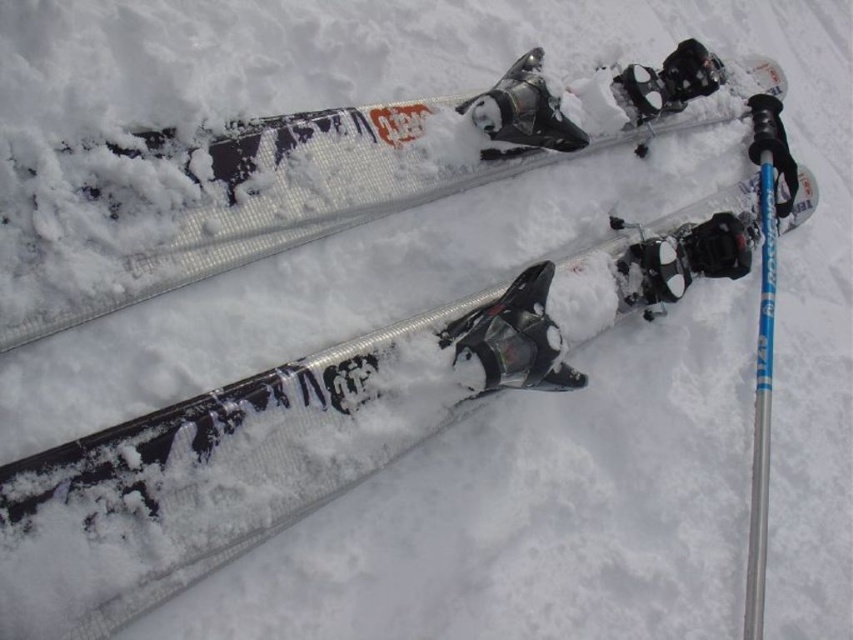
From the picture: You are a winter sports enthusiast who wants to organize your gear. You have a storage rack with two hooks. The left hook can hold up to 1.2 meters in length, and the right hook can hold up to 1 meter. You need to hang the silver metallic skis at center and the blue metallic pole at right. Based on their positions in the image, which object should go on which hook to ensure they fit properly?

The silver metallic skis at center should be placed on the left hook because they are longer than the blue metallic pole at right, and the left hook can hold up to 1.2 meters. The blue metallic pole at right should go on the right hook since it is shorter and fits within the 1 meter limit.

You are a photographer trying to capture the silver metallic skis at center in your shot. Based on their position coordinates, where should you aim your camera to ensure they are centered in the frame?

The silver metallic skis at center are located at coordinates point (328, 189), so you should aim your camera at that position to center them in the frame.